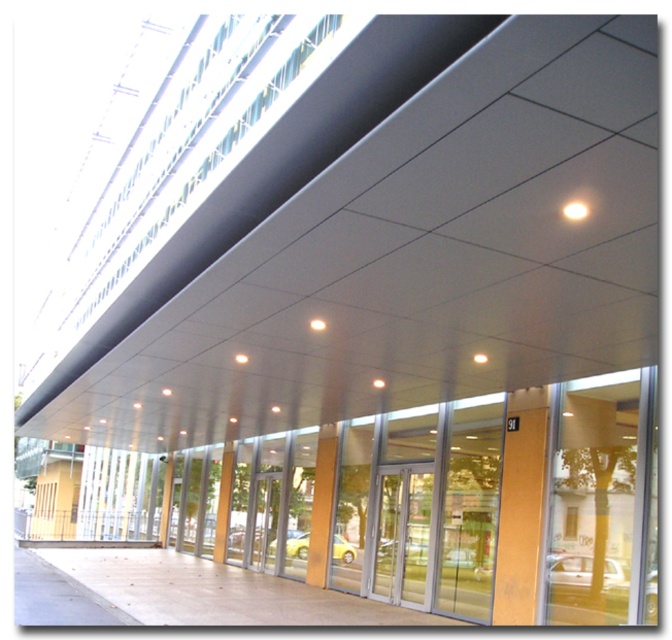
Question: Which is farther from the transparent glass door at center?

Choices:
 (A) yellow matte pillar at center
 (B) smooth yellow pillar at center

Answer: (B)

Question: Based on their relative distances, which object is nearer to the yellow matte pillar at center?

Choices:
 (A) smooth yellow pillar at center
 (B) transparent glass door at center

Answer: (B)

Question: Is transparent glass door at center thinner than smooth yellow pillar at center?

Choices:
 (A) yes
 (B) no

Answer: (B)

Question: Which point appears closest to the camera in this image?

Choices:
 (A) (222, 538)
 (B) (317, 564)
 (C) (407, 589)

Answer: (C)

Question: From the image, what is the correct spatial relationship of transparent glass door at center in relation to yellow matte pillar at center?

Choices:
 (A) above
 (B) below

Answer: (A)

Question: Does transparent glass door at center appear under yellow matte pillar at center?

Choices:
 (A) yes
 (B) no

Answer: (B)